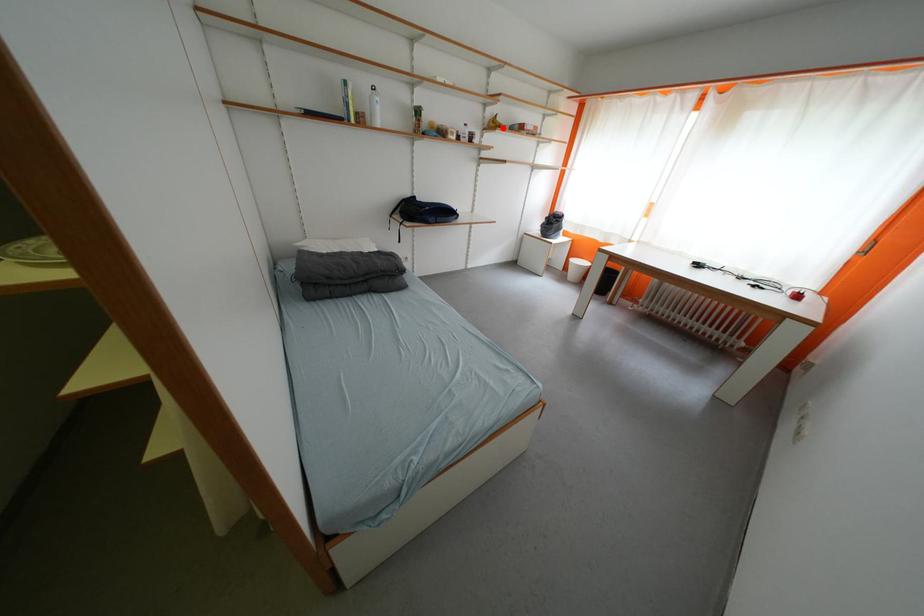
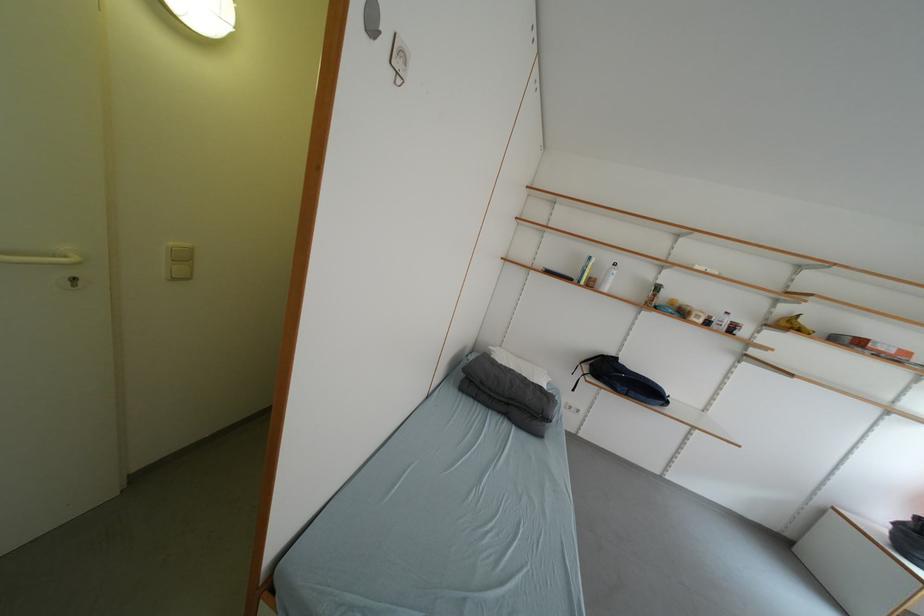
Find the pixel in the second image that matches the highlighted location in the first image.

(797, 328)